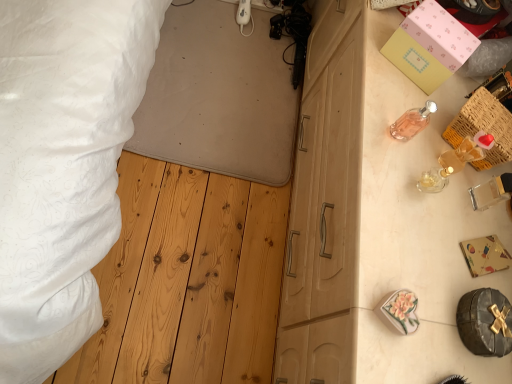
Locate an element on the screen. The image size is (512, 384). vacant area that lies between pink glass perfume at upper right and woven wood crate at upper right is located at coordinates click(x=420, y=134).